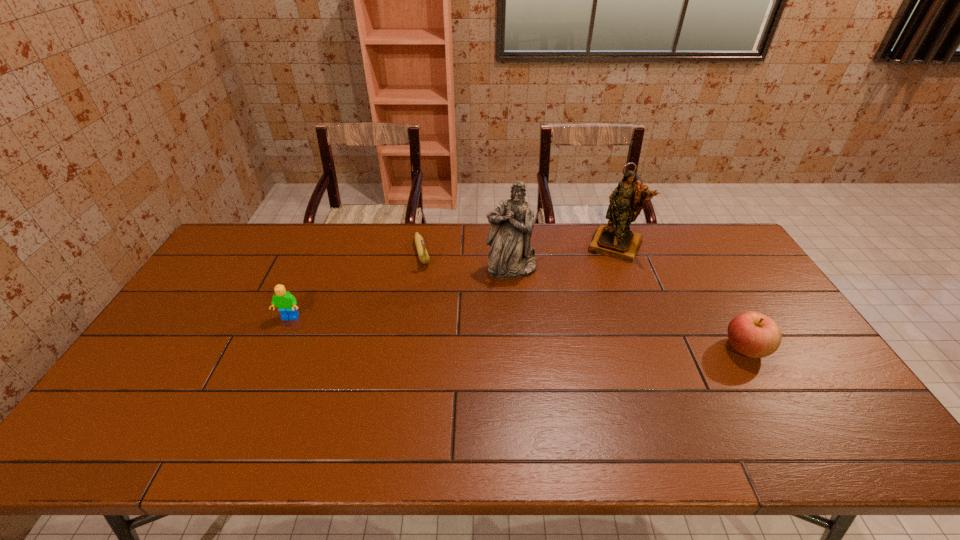
Identify the location of vacant space on the desktop that is between the leftmost object and the nearest object and is positioned on the front-facing side of the second object from right to left. The height and width of the screenshot is (540, 960). (571, 337).

You are a GUI agent. You are given a task and a screenshot of the screen. Output one action in this format:
    pyautogui.click(x=<x>, y=<y>)
    Task: Click on the free space on the desktop that is between the fourth farthest object and the rightmost object and is positioned on the front-facing side of the third object from right to left
    
    Given the screenshot: What is the action you would take?
    pyautogui.click(x=526, y=334)

Find the location of `free spot on the desktop that is between the Lego and the apple and is positioned at the stem of the second object from left to right`. free spot on the desktop that is between the Lego and the apple and is positioned at the stem of the second object from left to right is located at coordinates (444, 328).